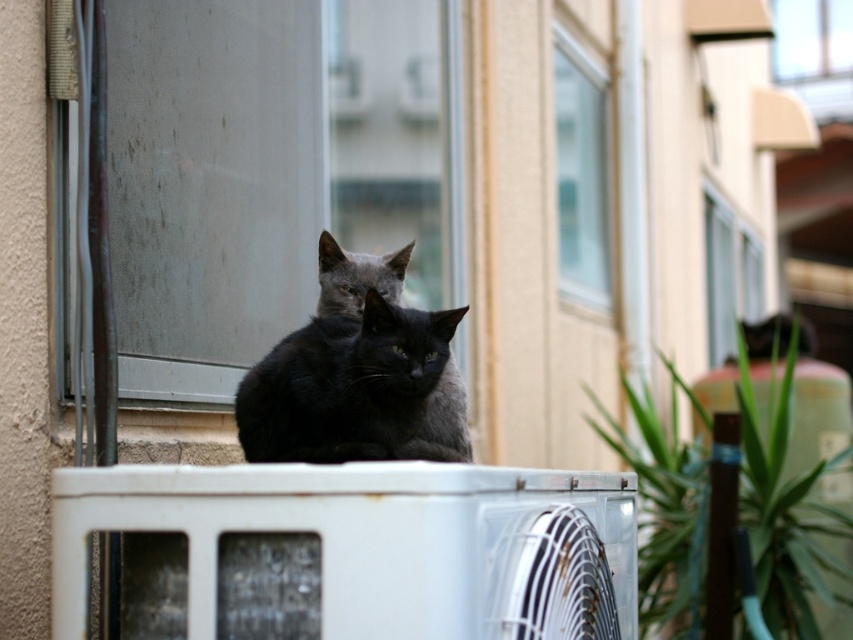
The image size is (853, 640). What do you see at coordinates (358, 374) in the screenshot?
I see `shiny black cat at center` at bounding box center [358, 374].

Is point (380, 275) more distant than point (556, 148)?

No, (380, 275) is closer to viewer.

The width and height of the screenshot is (853, 640). What are the coordinates of `shiny black cat at center` in the screenshot? It's located at (358, 374).

From the picture: Which is above, transparent glass window at upper center or clear glass window at upper center?

clear glass window at upper center

In the scene shown: Can you confirm if transparent glass window at upper center is bigger than clear glass window at upper center?

Indeed, transparent glass window at upper center has a larger size compared to clear glass window at upper center.

Does point (276, 109) come closer to viewer compared to point (585, 84)?

Yes, it is.

The image size is (853, 640). In order to click on transparent glass window at upper center in this screenshot , I will do `click(270, 172)`.

Who is more forward, (x=602, y=221) or (x=746, y=264)?

Point (x=602, y=221)

Between clear glass window at upper center and clear glass window at upper right, which one appears on the left side from the viewer's perspective?

clear glass window at upper center

Locate an element on the screen. The height and width of the screenshot is (640, 853). clear glass window at upper center is located at coordinates (581, 173).

Where is `clear glass window at upper center`? This screenshot has height=640, width=853. clear glass window at upper center is located at coordinates (581, 173).